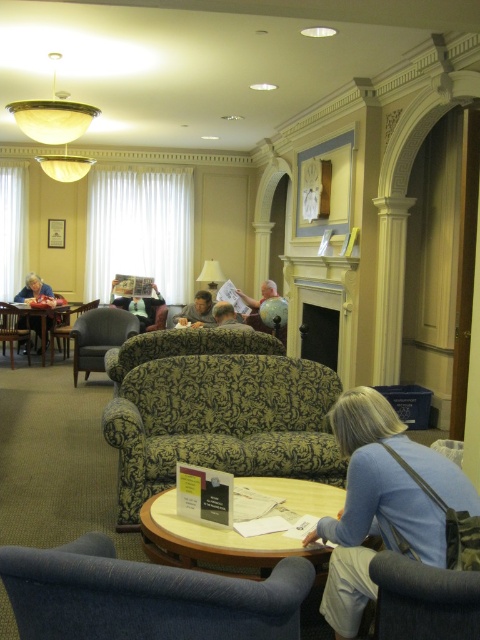
What are the coordinates of the matte black armchair at left?

The coordinates of the matte black armchair at left are (12, 328).

You are planning to host a small gathering in this space and need to know if the green floral fabric couch at center and the blue fabric armchair at lower left can be positioned closer together to encourage conversation. Based on their current distance, is there enough space to move them closer without overlapping?

The green floral fabric couch at center and blue fabric armchair at lower left are currently 6.97 feet apart. Since they are already positioned over 6 feet apart, there is sufficient space to move them closer while maintaining a comfortable distance for conversation without overlapping.